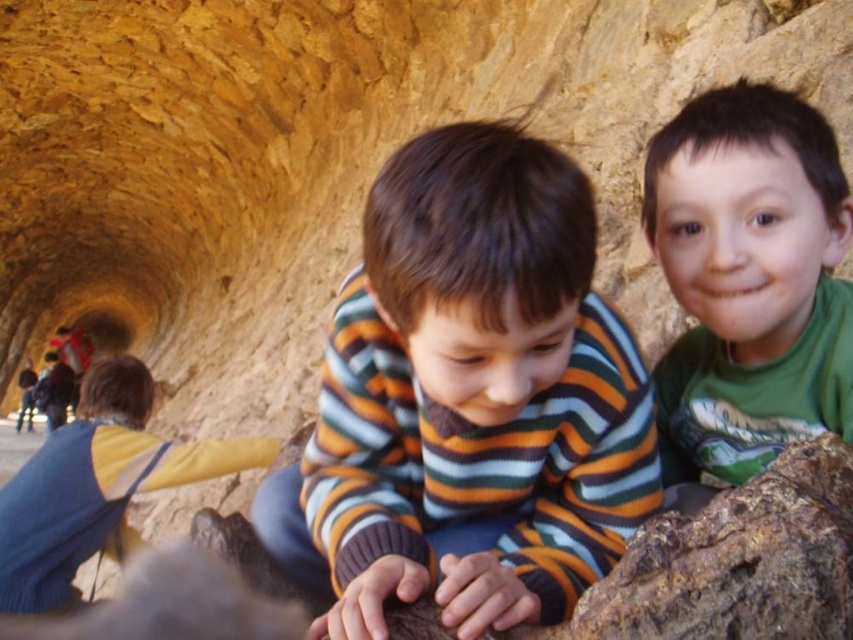
Is point (485, 204) farther from viewer compared to point (801, 141)?

No, (485, 204) is in front of (801, 141).

Locate an element on the screen. striped sweater at center is located at coordinates (469, 397).

The image size is (853, 640). Identify the location of striped sweater at center. 469,397.